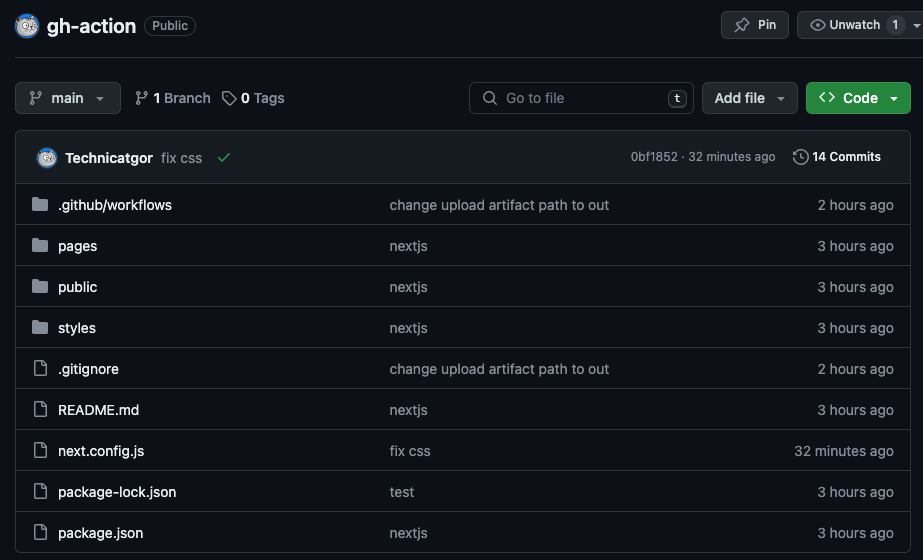
Find the location of a particular element. folders is located at coordinates (39, 200), (39, 240), (39, 284), (40, 326).